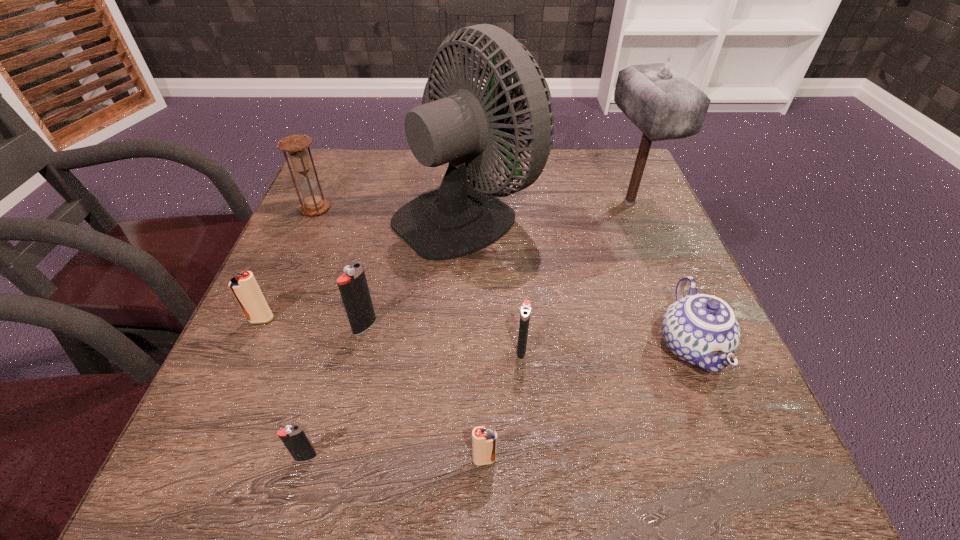
At what (x,y) coordinates should I click in order to perform the action: click on igniter that is the closest to the left red igniter. Please return your answer as a coordinate pair (x, y). Looking at the image, I should click on (353, 287).

At what (x,y) coordinates should I click in order to perform the action: click on igniter that stands as the fourth closest to the smallest black igniter. Please return your answer as a coordinate pair (x, y). Looking at the image, I should click on (526, 306).

The height and width of the screenshot is (540, 960). Identify the location of black igniter that is the second nearest to the second igniter from right to left. (293, 437).

Where is `black igniter that is the second closest to the second smallest black igniter`? Image resolution: width=960 pixels, height=540 pixels. black igniter that is the second closest to the second smallest black igniter is located at coordinates (293, 437).

Where is `blank space that satisfies the following two spatial constraints: 1. on the back side of the fourth igniter from left to right; 2. on the right side of the mallet`? The image size is (960, 540). blank space that satisfies the following two spatial constraints: 1. on the back side of the fourth igniter from left to right; 2. on the right side of the mallet is located at coordinates (483, 203).

In order to click on vacant space that satisfies the following two spatial constraints: 1. on the front side of the mallet; 2. in front of the fan to direct airflow in this screenshot , I will do `click(633, 212)`.